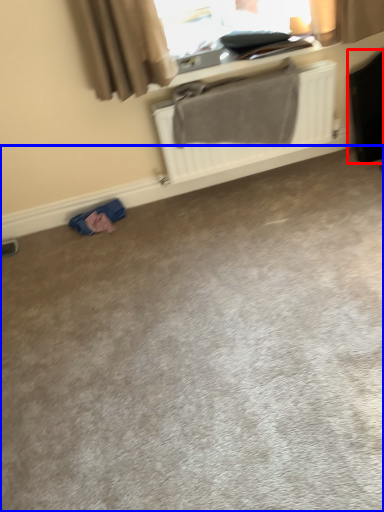
Question: Among these objects, which one is farthest to the camera, luggage (highlighted by a red box) or concrete (highlighted by a blue box)?

Choices:
 (A) luggage
 (B) concrete

Answer: (A)